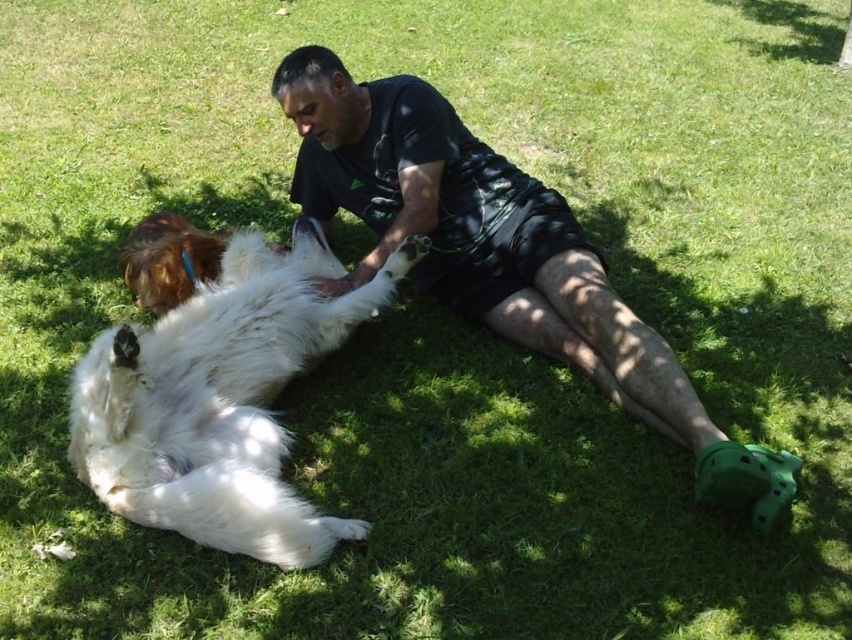
Does black matte shorts at center have a larger size compared to white fluffy dog at center?

Yes, black matte shorts at center is bigger than white fluffy dog at center.

Between black matte shorts at center and white fluffy dog at center, which one is positioned higher?

black matte shorts at center

Does point (607, 317) come behind point (357, 524)?

That is True.

Locate an element on the screen. Image resolution: width=852 pixels, height=640 pixels. black matte shorts at center is located at coordinates (499, 256).